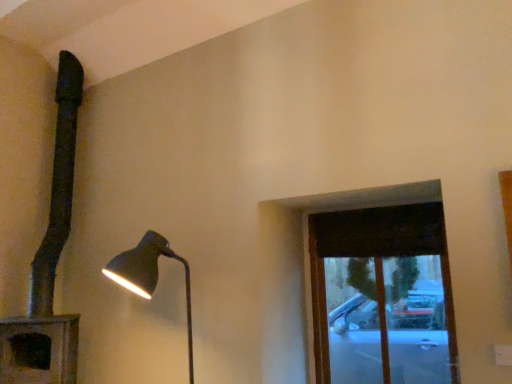
Question: From the image's perspective, is dark wood window at upper right positioned above or below matte black lamp at left, which is counted as the 1th lamp, starting from the left?

Choices:
 (A) below
 (B) above

Answer: (A)

Question: Based on their sizes in the image, would you say dark wood window at upper right is bigger or smaller than matte black lamp at left, which is counted as the 2th lamp, starting from the right?

Choices:
 (A) big
 (B) small

Answer: (B)

Question: Which is farther from the matte black lamp at left, the first lamp in the right-to-left sequence?

Choices:
 (A) matte black lamp at left, which is counted as the 2th lamp, starting from the right
 (B) dark wood window at upper right

Answer: (B)

Question: Which is nearer to the matte black lamp at left, marked as the 2th lamp in a left-to-right arrangement?

Choices:
 (A) matte black lamp at left, which is counted as the 2th lamp, starting from the right
 (B) dark wood window at upper right

Answer: (A)